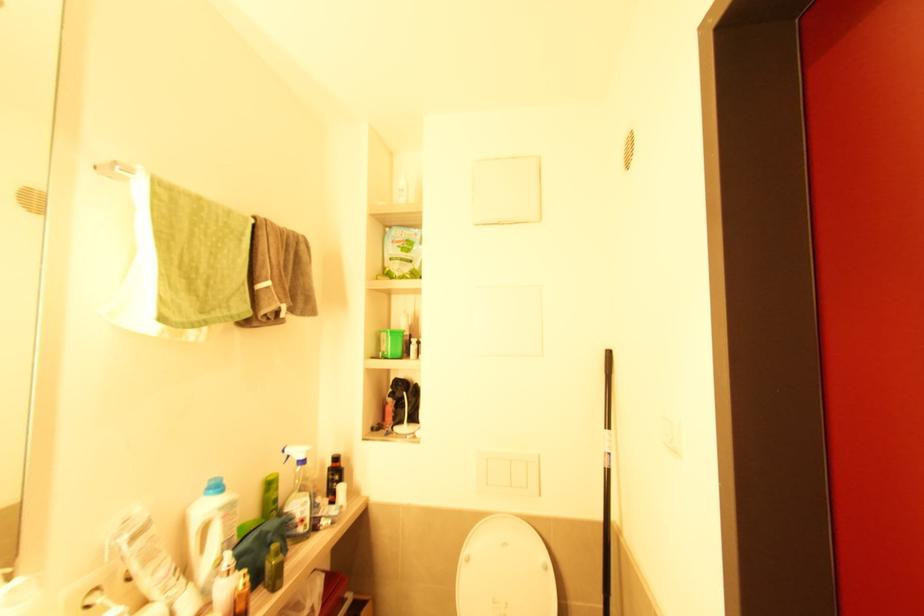
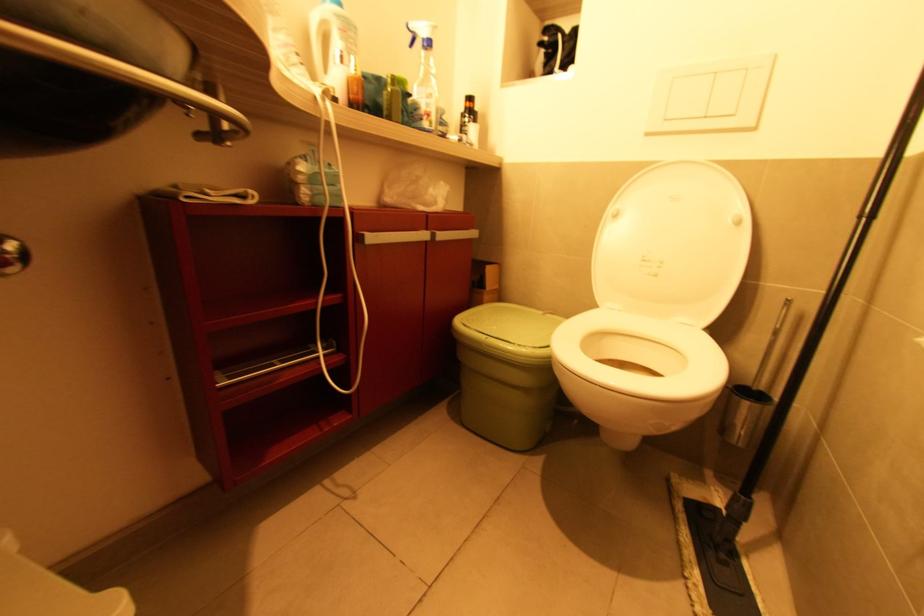
The point at (x=298, y=527) is marked in the first image. Where is the corresponding point in the second image?

(424, 121)